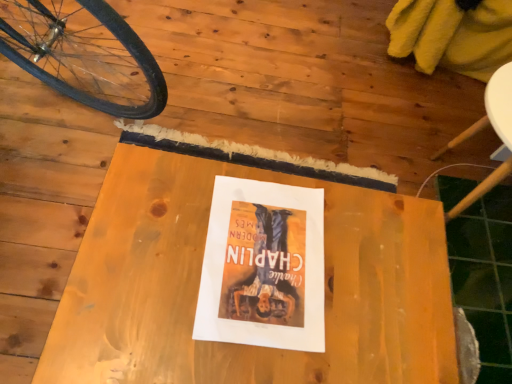
Question: Is wooden table at center inside the boundaries of white paper at center, or outside?

Choices:
 (A) outside
 (B) inside

Answer: (A)

Question: Visually, is wooden table at center positioned to the left or to the right of white paper at center?

Choices:
 (A) right
 (B) left

Answer: (B)

Question: Looking at their shapes, would you say wooden table at center is wider or thinner than white paper at center?

Choices:
 (A) wide
 (B) thin

Answer: (A)

Question: Considering the positions of point (228, 208) and point (421, 231), is point (228, 208) closer or farther from the camera than point (421, 231)?

Choices:
 (A) farther
 (B) closer

Answer: (B)

Question: From their relative heights in the image, would you say white paper at center is taller or shorter than wooden table at center?

Choices:
 (A) tall
 (B) short

Answer: (B)

Question: Is white paper at center wider or thinner than wooden table at center?

Choices:
 (A) thin
 (B) wide

Answer: (A)

Question: From a real-world perspective, is white paper at center positioned above or below wooden table at center?

Choices:
 (A) below
 (B) above

Answer: (B)